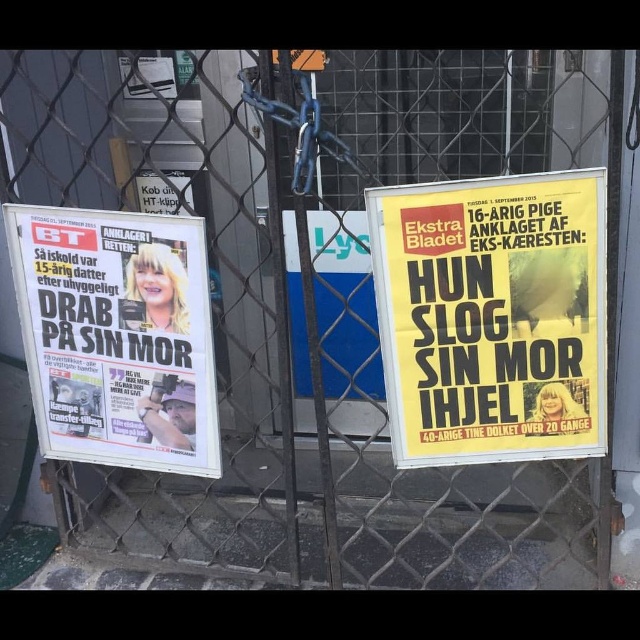
You are standing in front of the closed shop with the newspaper stands. There are two points marked on the image. Which point, point (x=374, y=198) or point (x=77, y=241), is closer to you?

Point (x=374, y=198) is closer to the viewer than point (x=77, y=241).

What is the spatial relationship between the yellow paper poster at right and the white glossy poster at left?

The yellow paper poster at right is located above the white glossy poster at left.

You are a delivery person trying to determine the best path to avoid the yellow paper poster at right and the white glossy poster at left. Which poster should you move around first, and why?

The yellow paper poster at right might be wider than the white glossy poster at left, so you should move around the yellow paper poster at right first to ensure enough space for passage.